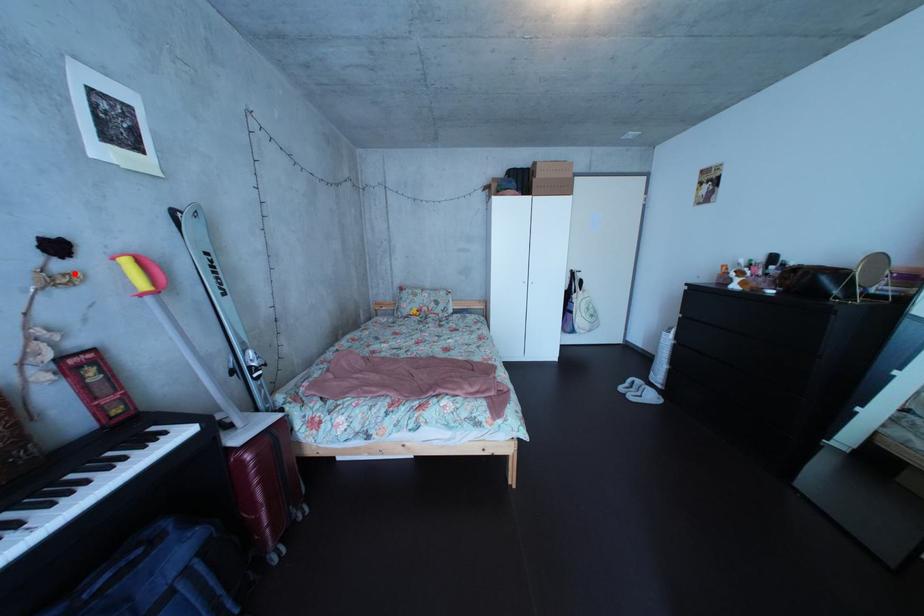
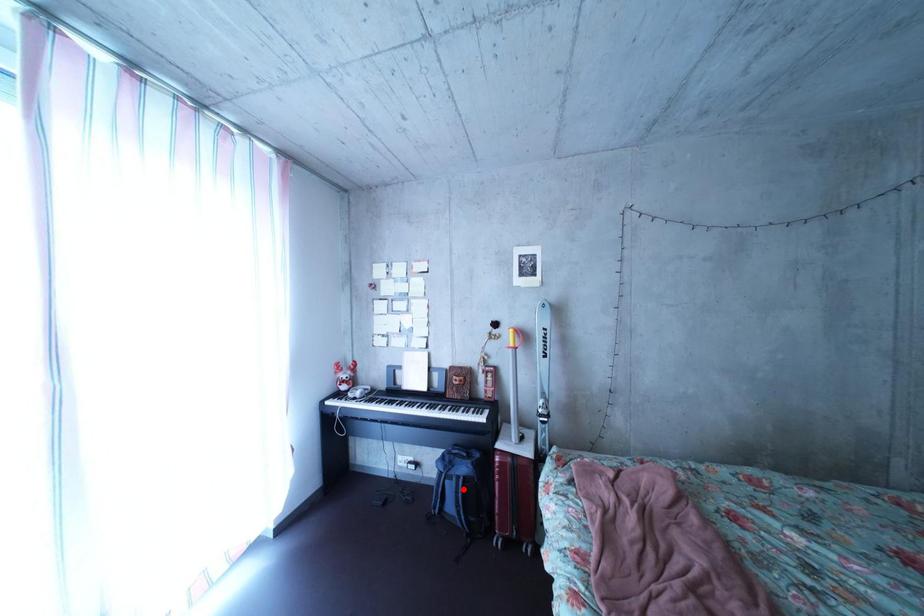
I am providing you with two images of the same scene from different viewpoints. A red point is marked on the first image and another point is marked on the second image. Is the marked point in image1 the same physical position as the marked point in image2?

No